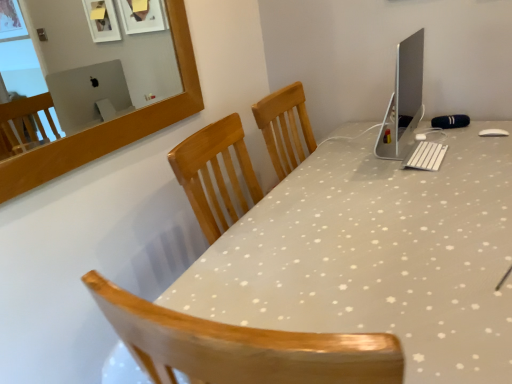
Where is `vacant region to the left of white plastic keyboard at center`? vacant region to the left of white plastic keyboard at center is located at coordinates (370, 167).